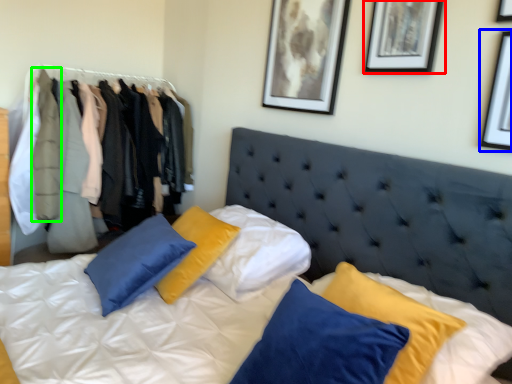
Question: Estimate the real-world distances between objects in this image. Which object is farther from picture frame (highlighted by a red box), picture frame (highlighted by a blue box) or clothing (highlighted by a green box)?

Choices:
 (A) picture frame
 (B) clothing

Answer: (B)